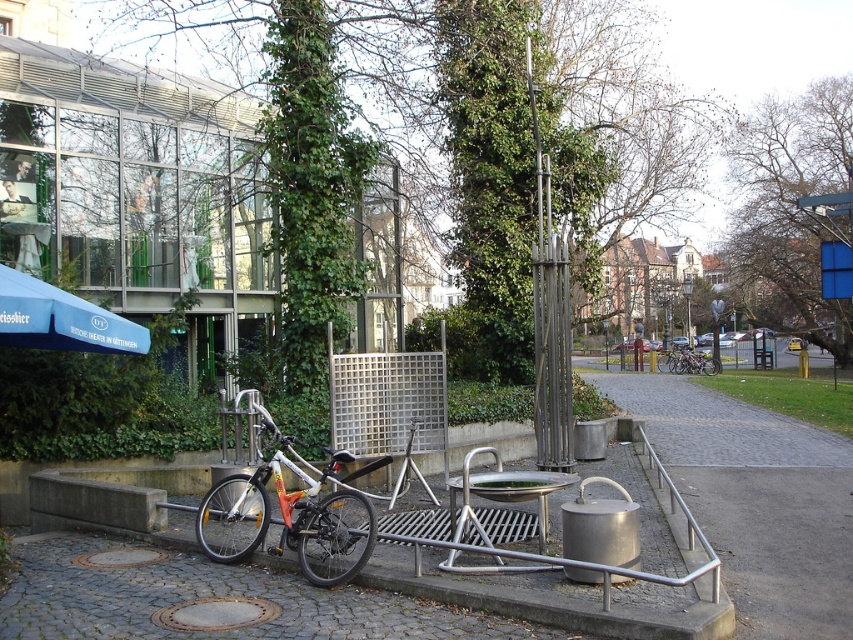
You are a delivery person who needs to move a box from the blue fabric umbrella at left to the white matte bicycle at center. Given that the box is 2 feet wide, can you carry it horizontally between them without tilting it?

The distance between the white matte bicycle at center and the blue fabric umbrella at left is 6.49 feet, which is more than enough space to carry a 2 feet wide box horizontally between them without tilting it.

You are a delivery person who needs to carry a package from the blue fabric umbrella at left to the white matte bicycle at center. Since the package is fragile, you want to avoid any obstacles taller than the umbrella. Is there any obstacle in the path between them that you need to be cautious of?

The white matte bicycle at center is taller than the blue fabric umbrella at left, so you need to be cautious of the white matte bicycle at center as it is taller than the umbrella and could potentially obstruct the path.